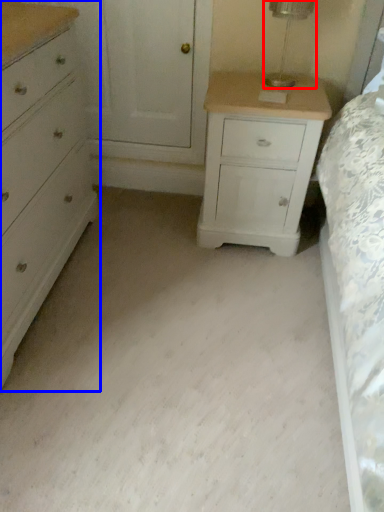
Question: Among these objects, which one is nearest to the camera, table lamp (highlighted by a red box) or chest of drawers (highlighted by a blue box)?

Choices:
 (A) table lamp
 (B) chest of drawers

Answer: (B)